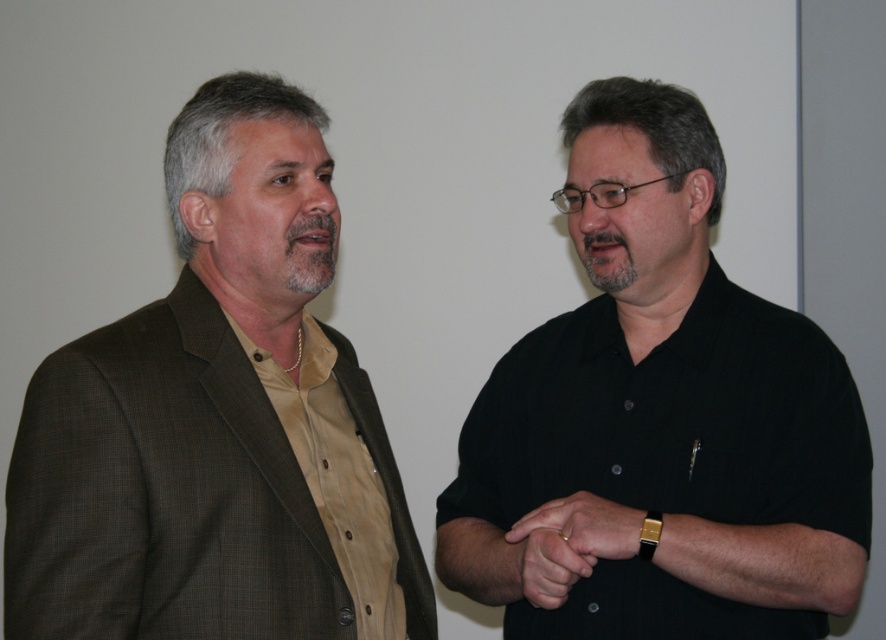
Is point (573, 552) positioned in front of point (514, 548)?

Yes, point (573, 552) is in front of point (514, 548).

Can you confirm if gold metallic watch at center is positioned above smooth skin hand at center?

Indeed, gold metallic watch at center is positioned over smooth skin hand at center.

Does point (535, 529) come behind point (556, 547)?

Yes, point (535, 529) is farther from viewer.

Find the location of `gold metallic watch at center`. gold metallic watch at center is located at coordinates (581, 528).

Between black matte shirt at right and gold metallic watch at center, which one has more height?

black matte shirt at right

Is black matte shirt at right to the right of gold metallic watch at center from the viewer's perspective?

Incorrect, black matte shirt at right is not on the right side of gold metallic watch at center.

Where is `black matte shirt at right`? The image size is (886, 640). black matte shirt at right is located at coordinates (664, 410).

Can you confirm if brown textured suit at left is smaller than smooth skin hand at center?

Actually, brown textured suit at left might be larger than smooth skin hand at center.

Which is below, brown textured suit at left or smooth skin hand at center?

smooth skin hand at center is lower down.

Does point (343, 586) come farther from viewer compared to point (527, 570)?

No, it is in front of (527, 570).

At what (x,y) coordinates should I click in order to perform the action: click on brown textured suit at left. Please return your answer as a coordinate pair (x, y). Looking at the image, I should click on (216, 420).